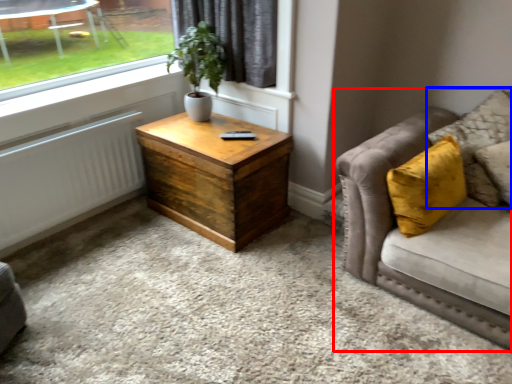
Question: Among these objects, which one is nearest to the camera, studio couch (highlighted by a red box) or pillow (highlighted by a blue box)?

Choices:
 (A) studio couch
 (B) pillow

Answer: (A)